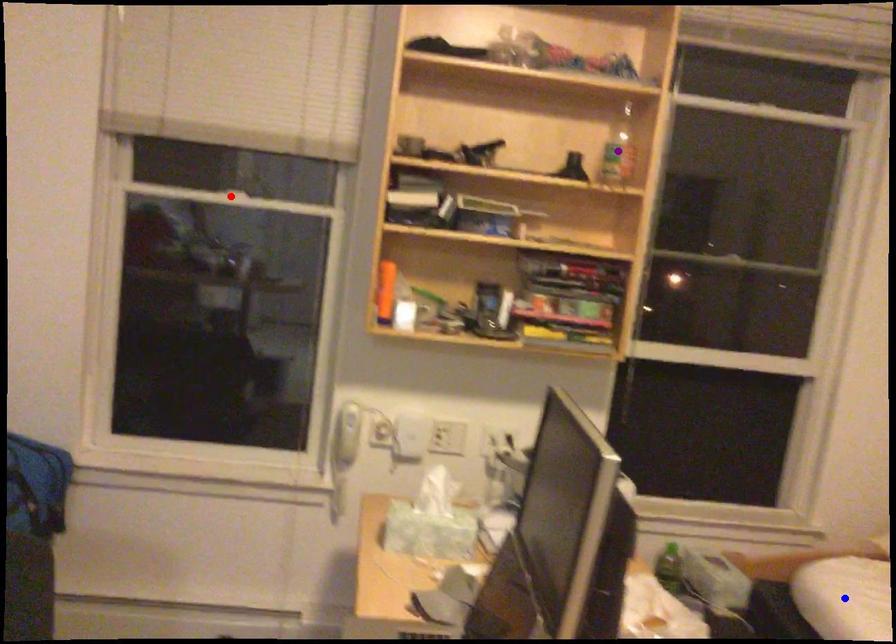
Order these from nearest to farthest:
purple point | red point | blue point

blue point < purple point < red point